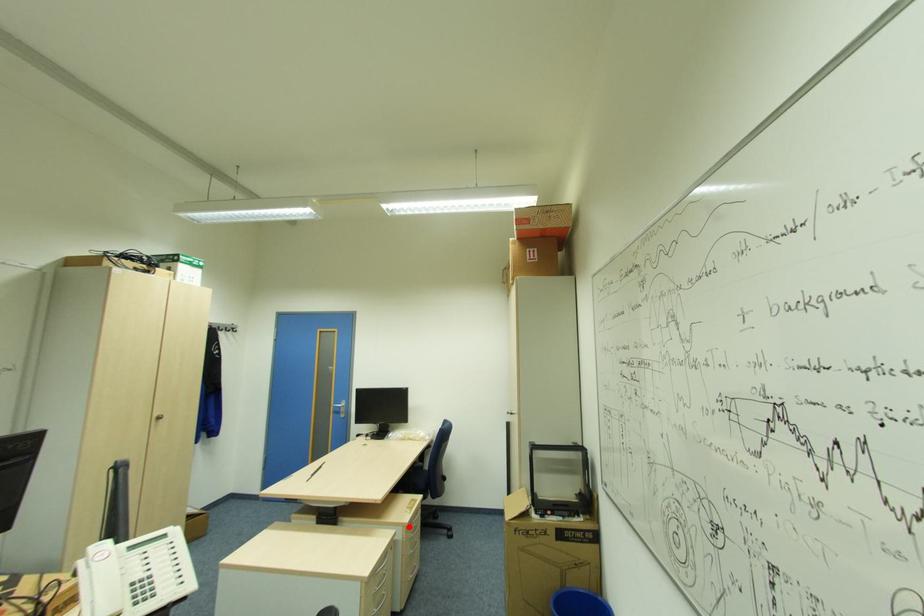
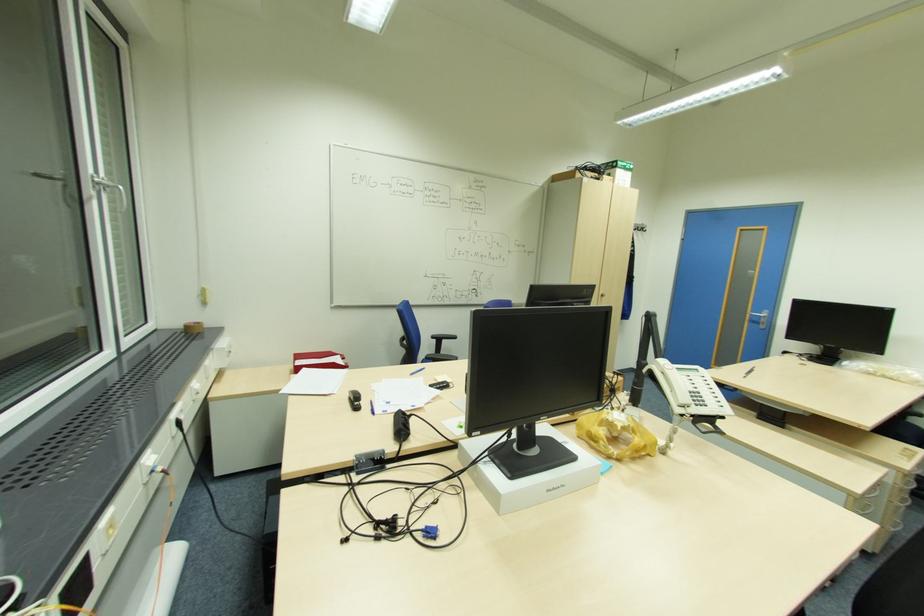
Where in the second image is the point corresponding to the highlighted location from the first image?

(907, 474)